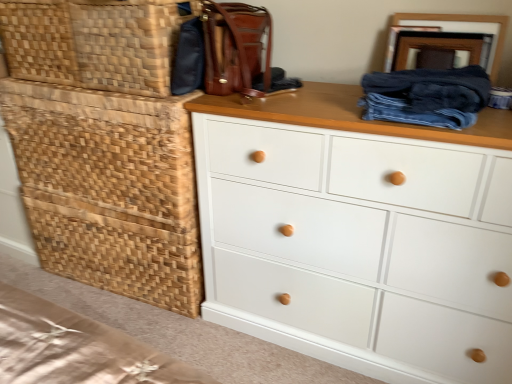
What is the approximate width of leather handbag at upper center?

leather handbag at upper center is 15.43 inches wide.

The height and width of the screenshot is (384, 512). Describe the element at coordinates (426, 96) in the screenshot. I see `dark blue denim jeans at upper right` at that location.

What do you see at coordinates (109, 189) in the screenshot?
I see `woven wood basket at left` at bounding box center [109, 189].

What do you see at coordinates (116, 253) in the screenshot? I see `woven wood basket at left, which is the second basket in top-to-bottom order` at bounding box center [116, 253].

Image resolution: width=512 pixels, height=384 pixels. I want to click on woven wood basket at left, which ranks as the 1th basket in bottom-to-top order, so click(x=116, y=253).

You are a GUI agent. You are given a task and a screenshot of the screen. Output one action in this format:
    pyautogui.click(x=<x>, y=<y>)
    Task: Click on the leather handbag at upper center
    This screenshot has width=512, height=384.
    Given the screenshot: What is the action you would take?
    pyautogui.click(x=236, y=49)

Does leather handbag at upper center appear on the right side of woven wood basket at left?

Yes.

From a real-world perspective, is leather handbag at upper center over woven wood basket at left?

Yes, from a real-world perspective, leather handbag at upper center is on top of woven wood basket at left.

Looking at this image, does leather handbag at upper center have a larger size compared to woven wood basket at left?

Actually, leather handbag at upper center might be smaller than woven wood basket at left.

Which object is closer to the camera taking this photo, leather handbag at upper center or woven wood basket at left?

leather handbag at upper center is more forward.

Looking at this image, from a real-world perspective, does dark blue denim jeans at upper right stand above white painted wood chest of drawers at center?

Yes, from a real-world perspective, dark blue denim jeans at upper right is above white painted wood chest of drawers at center.

You are a GUI agent. You are given a task and a screenshot of the screen. Output one action in this format:
    pyautogui.click(x=<x>, y=<y>)
    Task: Click on the clothing above the white painted wood chest of drawers at center (from a real-world perspective)
    This screenshot has height=384, width=512.
    Given the screenshot: What is the action you would take?
    pyautogui.click(x=426, y=96)

Is dark blue denim jeans at upper right next to white painted wood chest of drawers at center and touching it?

There is a gap between dark blue denim jeans at upper right and white painted wood chest of drawers at center.

Looking at this image, which object is thinner, woven wood basket at left, which is the second basket in top-to-bottom order, or leather handbag at upper center?

leather handbag at upper center is thinner.

Looking at this image, can you see woven wood basket at left, which is the second basket in top-to-bottom order, touching leather handbag at upper center?

There is a gap between woven wood basket at left, which is the second basket in top-to-bottom order, and leather handbag at upper center.

Is point (36, 232) closer or farther from the camera than point (250, 22)?

Point (36, 232) appears to be farther away from the viewer than point (250, 22).

Considering the sizes of objects woven wood basket at left, which ranks as the 1th basket in bottom-to-top order, and leather handbag at upper center in the image provided, who is smaller, woven wood basket at left, which ranks as the 1th basket in bottom-to-top order, or leather handbag at upper center?

With smaller size is leather handbag at upper center.

Who is more distant, woven wood basket at left or dark blue denim jeans at upper right?

woven wood basket at left is further from the camera.

Find the location of a particular element. This screenshot has height=384, width=512. crate that is behind the dark blue denim jeans at upper right is located at coordinates (109, 189).

Which is behind, point (27, 170) or point (440, 73)?

The point (27, 170) is more distant.

Is dark blue denim jeans at upper right next to leather handbag at upper center and touching it?

No, dark blue denim jeans at upper right is not touching leather handbag at upper center.

Who is more distant, dark blue denim jeans at upper right or leather handbag at upper center?

leather handbag at upper center is further from the camera.

Who is taller, dark blue denim jeans at upper right or leather handbag at upper center?

leather handbag at upper center.

Based on the photo, from a real-world perspective, is white painted wood chest of drawers at center physically located above or below woven wood basket at left, which ranks as the 1th basket in bottom-to-top order?

white painted wood chest of drawers at center is above woven wood basket at left, which ranks as the 1th basket in bottom-to-top order.

Consider the image. Is white painted wood chest of drawers at center with woven wood basket at left, which is the second basket in top-to-bottom order?

No, white painted wood chest of drawers at center is not in contact with woven wood basket at left, which is the second basket in top-to-bottom order.

Considering the relative sizes of white painted wood chest of drawers at center and woven wood basket at left, which ranks as the 1th basket in bottom-to-top order, in the image provided, is white painted wood chest of drawers at center thinner than woven wood basket at left, which ranks as the 1th basket in bottom-to-top order,?

No.

Measure the distance between woven wood basket at left and white painted wood chest of drawers at center.

18.63 inches.

Is woven wood basket at left next to white painted wood chest of drawers at center and touching it?

No.

In the scene shown: Could you tell me if woven wood basket at left is facing white painted wood chest of drawers at center?

No, woven wood basket at left is not aimed at white painted wood chest of drawers at center.

Which object is closer to the camera, woven wood basket at left or white painted wood chest of drawers at center?

white painted wood chest of drawers at center is closer to the camera.

The height and width of the screenshot is (384, 512). Find the location of `crate that is behind the leather handbag at upper center`. crate that is behind the leather handbag at upper center is located at coordinates (109, 189).

This screenshot has width=512, height=384. Find the location of `chest of drawers below the dark blue denim jeans at upper right (from the image's perspective)`. chest of drawers below the dark blue denim jeans at upper right (from the image's perspective) is located at coordinates [358, 234].

From the image, which object appears to be farther from white painted wood chest of drawers at center, woven wood basket at left, which is the second basket in top-to-bottom order, or dark blue denim jeans at upper right?

woven wood basket at left, which is the second basket in top-to-bottom order, is positioned further to the anchor white painted wood chest of drawers at center.

Based on their spatial positions, is white painted wood chest of drawers at center or woven brown basket at upper left, the second basket positioned from the bottom, closer to woven wood basket at left?

woven brown basket at upper left, the second basket positioned from the bottom, is positioned closer to the anchor woven wood basket at left.

When comparing their distances from white painted wood chest of drawers at center, does woven wood basket at left or dark blue denim jeans at upper right seem further?

woven wood basket at left is positioned further to the anchor white painted wood chest of drawers at center.

Based on their spatial positions, is leather handbag at upper center or woven brown basket at upper left, arranged as the first basket when viewed from the top, closer to woven wood basket at left?

The object closer to woven wood basket at left is woven brown basket at upper left, arranged as the first basket when viewed from the top.

Looking at the image, which one is located further to woven wood basket at left, which is the second basket in top-to-bottom order, white painted wood chest of drawers at center or woven wood basket at left?

white painted wood chest of drawers at center.

Considering their positions, is woven brown basket at upper left, the second basket positioned from the bottom, positioned closer to woven wood basket at left, which ranks as the 1th basket in bottom-to-top order, than leather handbag at upper center?

woven brown basket at upper left, the second basket positioned from the bottom, is closer to woven wood basket at left, which ranks as the 1th basket in bottom-to-top order.

From the image, which object appears to be farther from white painted wood chest of drawers at center, woven brown basket at upper left, the second basket positioned from the bottom, or dark blue denim jeans at upper right?

Among the two, woven brown basket at upper left, the second basket positioned from the bottom, is located further to white painted wood chest of drawers at center.

Considering their positions, is leather handbag at upper center positioned further to dark blue denim jeans at upper right than white painted wood chest of drawers at center?

leather handbag at upper center lies further to dark blue denim jeans at upper right than the other object.

At what (x,y) coordinates should I click in order to perform the action: click on crate located between woven brown basket at upper left, arranged as the first basket when viewed from the top, and dark blue denim jeans at upper right in the left-right direction. Please return your answer as a coordinate pair (x, y). The image size is (512, 384). Looking at the image, I should click on (109, 189).

Find the location of a particular element. Image resolution: width=512 pixels, height=384 pixels. crate located between woven wood basket at left, which is the second basket in top-to-bottom order, and dark blue denim jeans at upper right in the left-right direction is located at coordinates (109, 189).

This screenshot has height=384, width=512. I want to click on the chest of drawers located between woven wood basket at left, which is the second basket in top-to-bottom order, and dark blue denim jeans at upper right in the left-right direction, so click(x=358, y=234).

Find the location of a particular element. This screenshot has width=512, height=384. handbag between woven brown basket at upper left, the second basket positioned from the bottom, and woven wood basket at left, which is the second basket in top-to-bottom order, vertically is located at coordinates (236, 49).